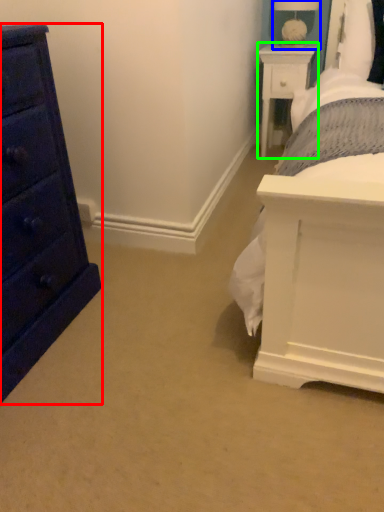
Question: Which object is positioned farthest from chest of drawers (highlighted by a red box)? Select from table lamp (highlighted by a blue box) and nightstand (highlighted by a green box).

Choices:
 (A) table lamp
 (B) nightstand

Answer: (A)